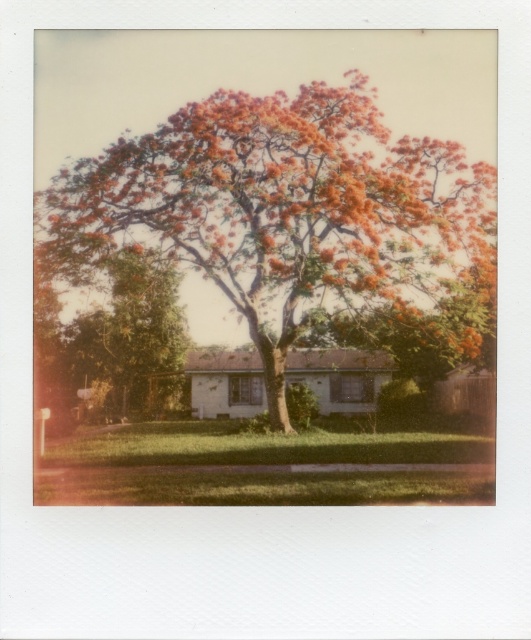
Does orange-brown textured tree at center have a greater width compared to green leafy tree at center?

Yes.

The height and width of the screenshot is (640, 531). What do you see at coordinates (284, 209) in the screenshot?
I see `orange-brown textured tree at center` at bounding box center [284, 209].

Where is `orange-brown textured tree at center`? This screenshot has width=531, height=640. orange-brown textured tree at center is located at coordinates (284, 209).